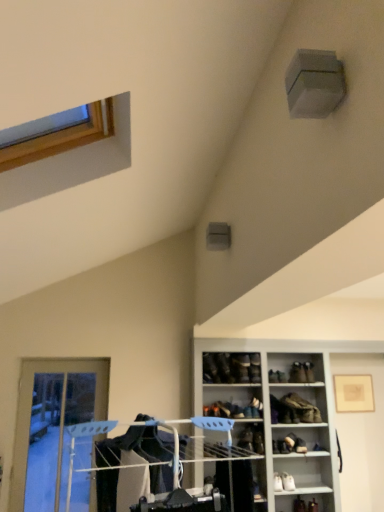
Question: From a real-world perspective, is leather boot at center, the third footwear ordered from the bottom, below white leather shoe at lower right, which is counted as the first footwear, starting from the bottom?

Choices:
 (A) yes
 (B) no

Answer: (B)

Question: Is leather boot at center, the 1th footwear when ordered from top to bottom, not inside white leather shoe at lower right, the 3th footwear positioned from the top?

Choices:
 (A) yes
 (B) no

Answer: (A)

Question: Is leather boot at center, the 1th footwear when ordered from top to bottom, taller than white leather shoe at lower right, which is counted as the first footwear, starting from the bottom?

Choices:
 (A) yes
 (B) no

Answer: (A)

Question: Does leather boot at center, the third footwear ordered from the bottom, appear on the right side of white leather shoe at lower right, the 3th footwear positioned from the top?

Choices:
 (A) no
 (B) yes

Answer: (B)

Question: Is leather boot at center, the third footwear ordered from the bottom, oriented away from white leather shoe at lower right, the 3th footwear positioned from the top?

Choices:
 (A) yes
 (B) no

Answer: (B)

Question: Is leather boot at center, the 1th footwear when ordered from top to bottom, aimed at white leather shoe at lower right, the 3th footwear positioned from the top?

Choices:
 (A) no
 (B) yes

Answer: (A)

Question: Is matte black shoe at upper center, the 4th shoe ordered from the bottom, at the right side of white leather shoe at lower right, the 3th footwear positioned from the top?

Choices:
 (A) no
 (B) yes

Answer: (A)

Question: Does matte black shoe at upper center, which is counted as the third shoe, starting from the right, have a lesser width compared to white leather shoe at lower right, the 3th footwear positioned from the top?

Choices:
 (A) no
 (B) yes

Answer: (A)

Question: From the image's perspective, is matte black shoe at upper center, the 4th shoe ordered from the bottom, over white leather shoe at lower right, which is counted as the first footwear, starting from the bottom?

Choices:
 (A) yes
 (B) no

Answer: (A)

Question: Considering the relative sizes of matte black shoe at upper center, which is the 1th shoe in top-to-bottom order, and white leather shoe at lower right, which is counted as the first footwear, starting from the bottom, in the image provided, is matte black shoe at upper center, which is the 1th shoe in top-to-bottom order, wider than white leather shoe at lower right, which is counted as the first footwear, starting from the bottom,?

Choices:
 (A) no
 (B) yes

Answer: (B)

Question: Considering the relative positions of matte black shoe at upper center, which is the 1th shoe in top-to-bottom order, and white leather shoe at lower right, the 3th footwear positioned from the top, in the image provided, is matte black shoe at upper center, which is the 1th shoe in top-to-bottom order, to the left of white leather shoe at lower right, the 3th footwear positioned from the top, from the viewer's perspective?

Choices:
 (A) no
 (B) yes

Answer: (B)

Question: Does matte black shoe at upper center, which is counted as the third shoe, starting from the right, contain white leather shoe at lower right, which is counted as the first footwear, starting from the bottom?

Choices:
 (A) no
 (B) yes

Answer: (A)

Question: Considering the relative sizes of matte black shoe at upper center, which ranks as the second shoe in left-to-right order, and black leather shoe at center, the 4th shoe viewed from the right, in the image provided, is matte black shoe at upper center, which ranks as the second shoe in left-to-right order, wider than black leather shoe at center, the 4th shoe viewed from the right,?

Choices:
 (A) yes
 (B) no

Answer: (A)